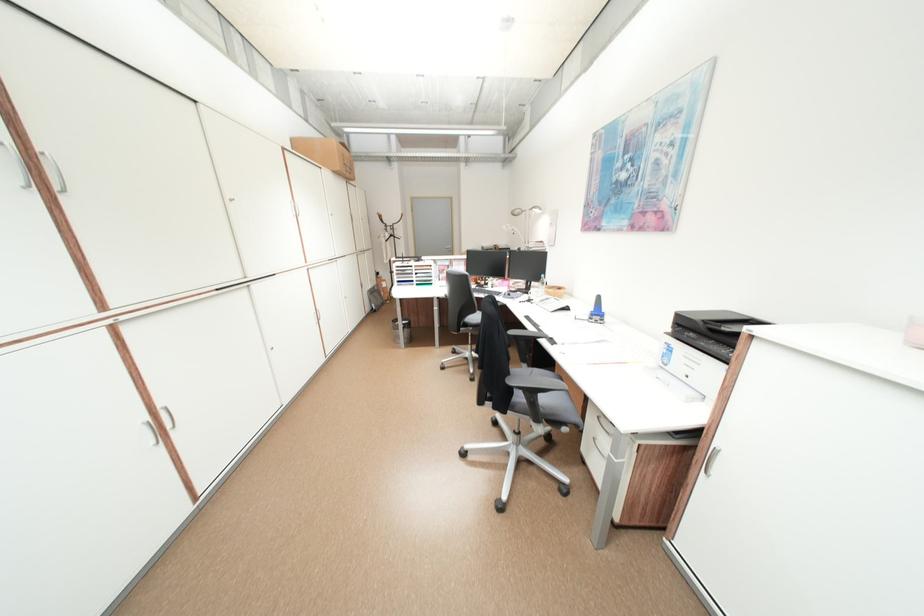
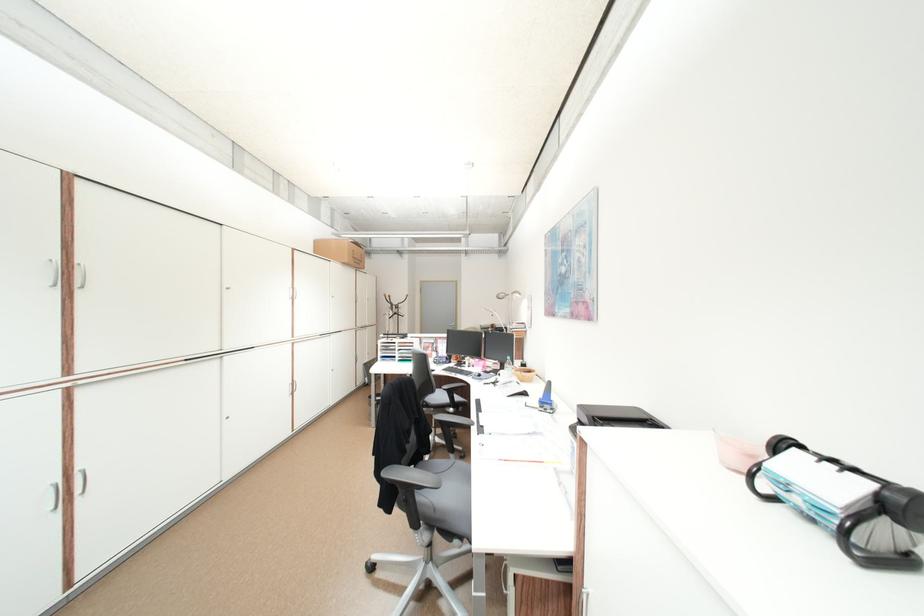
Locate, in the second image, the point that corresponds to (709,455) in the first image.

(584, 599)